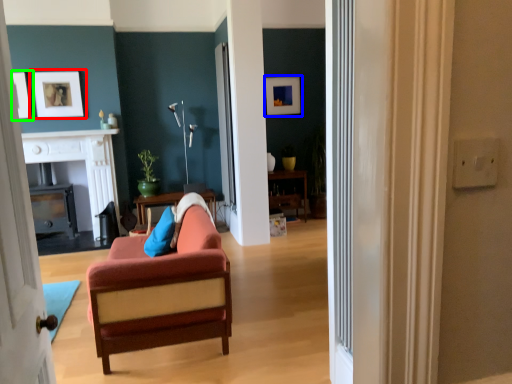
Question: Which object is positioned closest to picture frame (highlighted by a red box)? Select from picture frame (highlighted by a blue box) and picture frame (highlighted by a green box).

Choices:
 (A) picture frame
 (B) picture frame

Answer: (B)